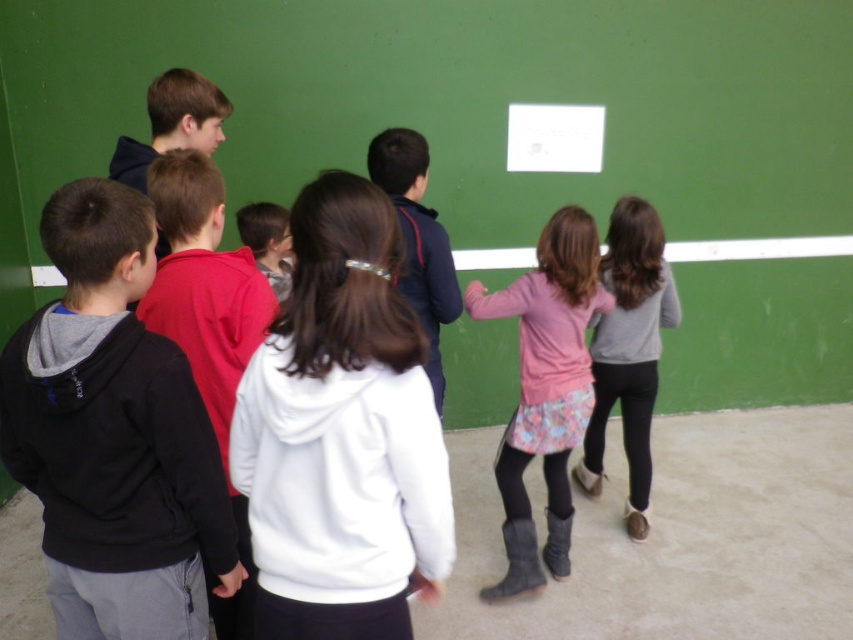
In the scene shown: You are a photographer trying to capture a photo of the children in the scene. You want to ensure that both the pink fabric skirt at center and the dark blue hoodie at center are clearly visible in the frame. Based on their positions, which one might be partially hidden and why?

The pink fabric skirt at center is positioned under the dark blue hoodie at center, so the pink fabric skirt at center might be partially hidden by the dark blue hoodie at center in the photo.